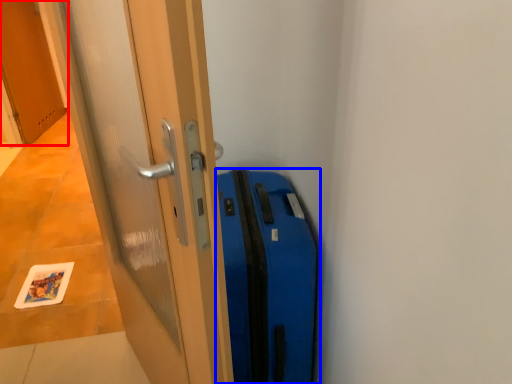
Question: Which object appears farthest to the camera in this image, door (highlighted by a red box) or suitcase (highlighted by a blue box)?

Choices:
 (A) door
 (B) suitcase

Answer: (A)